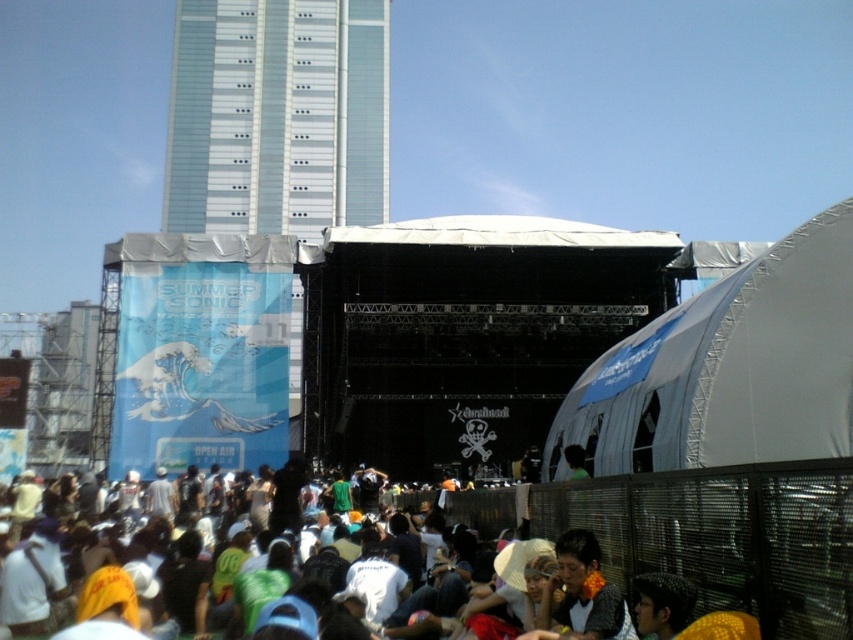
Consider the image. Does white cotton shirt at lower center have a lesser width compared to glassy steel tower at upper left?

Correct, white cotton shirt at lower center's width is less than glassy steel tower at upper left's.

Which of these two, white cotton shirt at lower center or glassy steel tower at upper left, stands shorter?

Standing shorter between the two is white cotton shirt at lower center.

At what (x,y) coordinates should I click in order to perform the action: click on white cotton shirt at lower center. Please return your answer as a coordinate pair (x, y). The width and height of the screenshot is (853, 640). Looking at the image, I should click on (573, 564).